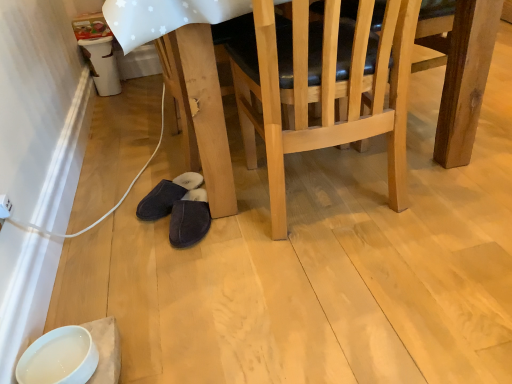
At what (x,y) coordinates should I click in order to perform the action: click on free space between natural wood chair at center and wooden table at lower center. Please return your answer as a coordinate pair (x, y). Looking at the image, I should click on (373, 226).